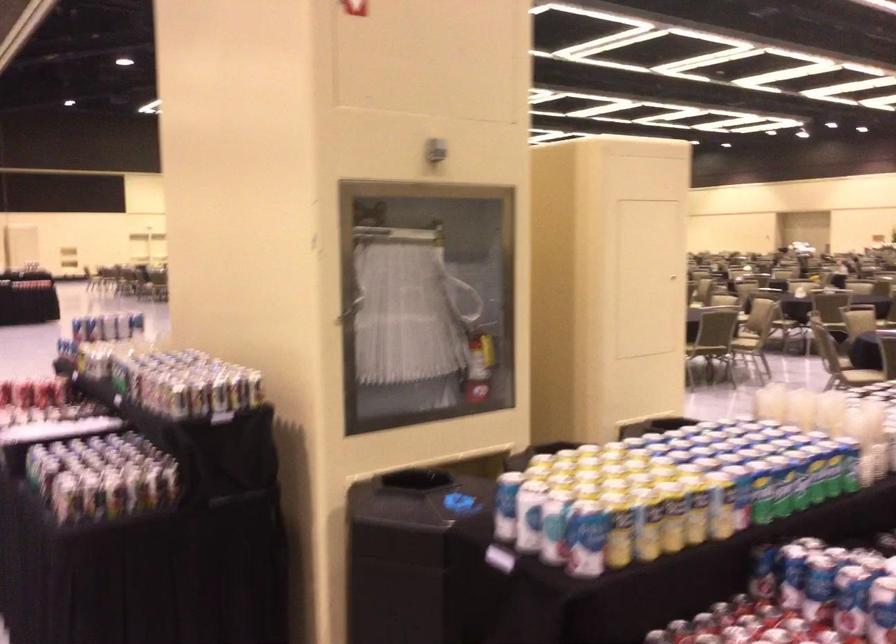
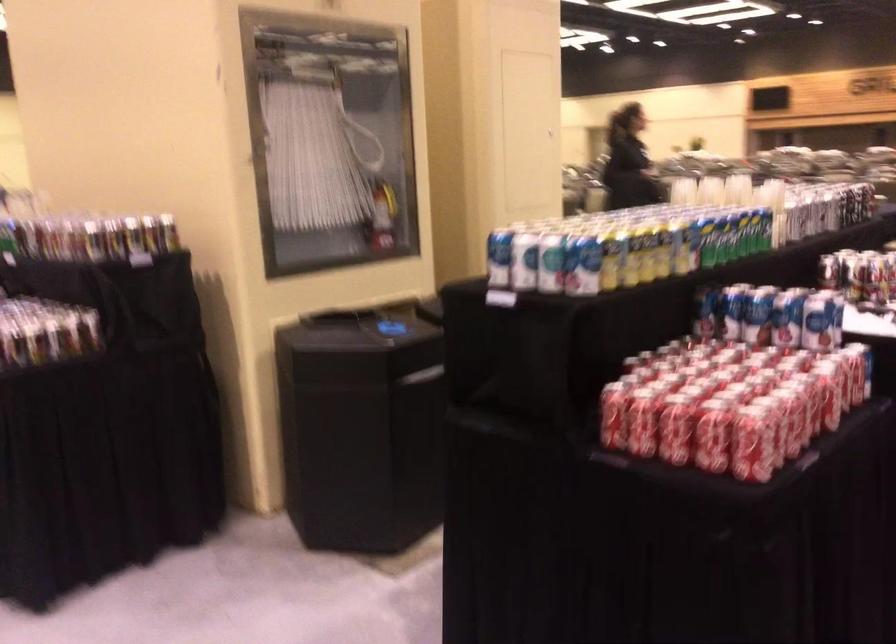
Where in the second image is the point corresponding to [757,573] from the first image?

(703, 312)